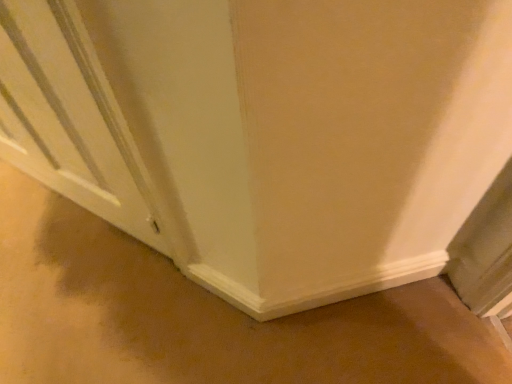
What is the approximate width of brown matte mud at lower left?

brown matte mud at lower left is 1.22 meters in width.

The height and width of the screenshot is (384, 512). What do you see at coordinates (220, 322) in the screenshot? I see `brown matte mud at lower left` at bounding box center [220, 322].

Locate an element on the screen. brown matte mud at lower left is located at coordinates (220, 322).

This screenshot has height=384, width=512. Identify the location of brown matte mud at lower left. (220, 322).